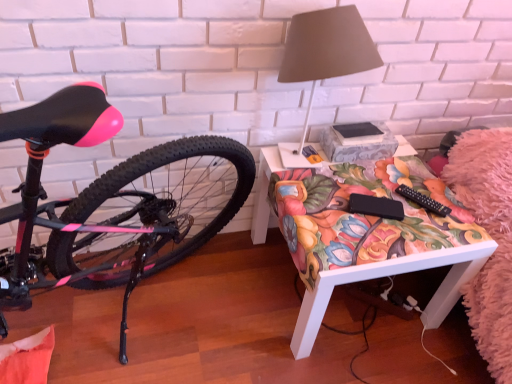
Question: Does black plastic remote control at lower right come behind floral fabric desk at center?

Choices:
 (A) no
 (B) yes

Answer: (B)

Question: From a real-world perspective, is black plastic remote control at lower right on floral fabric desk at center?

Choices:
 (A) yes
 (B) no

Answer: (A)

Question: Does black plastic remote control at lower right have a greater width compared to floral fabric desk at center?

Choices:
 (A) yes
 (B) no

Answer: (B)

Question: Considering the relative sizes of black plastic remote control at lower right and floral fabric desk at center in the image provided, is black plastic remote control at lower right taller than floral fabric desk at center?

Choices:
 (A) no
 (B) yes

Answer: (A)

Question: Is there a large distance between black plastic remote control at lower right and floral fabric desk at center?

Choices:
 (A) no
 (B) yes

Answer: (A)

Question: Does point (296, 331) appear closer or farther from the camera than point (443, 206)?

Choices:
 (A) farther
 (B) closer

Answer: (B)

Question: In the image, is floral fabric desk at center positioned in front of or behind black plastic remote control at lower right?

Choices:
 (A) front
 (B) behind

Answer: (A)

Question: From a real-world perspective, is floral fabric desk at center physically located above or below black plastic remote control at lower right?

Choices:
 (A) above
 (B) below

Answer: (B)

Question: Is floral fabric desk at center inside or outside of black plastic remote control at lower right?

Choices:
 (A) inside
 (B) outside

Answer: (B)

Question: From the image's perspective, is black plastic remote control at lower right above or below matte gray lampshade at upper right?

Choices:
 (A) below
 (B) above

Answer: (A)

Question: In the image, is black plastic remote control at lower right positioned in front of or behind matte gray lampshade at upper right?

Choices:
 (A) behind
 (B) front

Answer: (A)

Question: Considering the positions of black plastic remote control at lower right and matte gray lampshade at upper right in the image, is black plastic remote control at lower right taller or shorter than matte gray lampshade at upper right?

Choices:
 (A) tall
 (B) short

Answer: (B)

Question: From a real-world perspective, is black plastic remote control at lower right physically located above or below matte gray lampshade at upper right?

Choices:
 (A) above
 (B) below

Answer: (B)

Question: Is matte gray lampshade at upper right taller or shorter than floral fabric desk at center?

Choices:
 (A) tall
 (B) short

Answer: (A)

Question: From a real-world perspective, is matte gray lampshade at upper right positioned above or below floral fabric desk at center?

Choices:
 (A) below
 (B) above

Answer: (B)